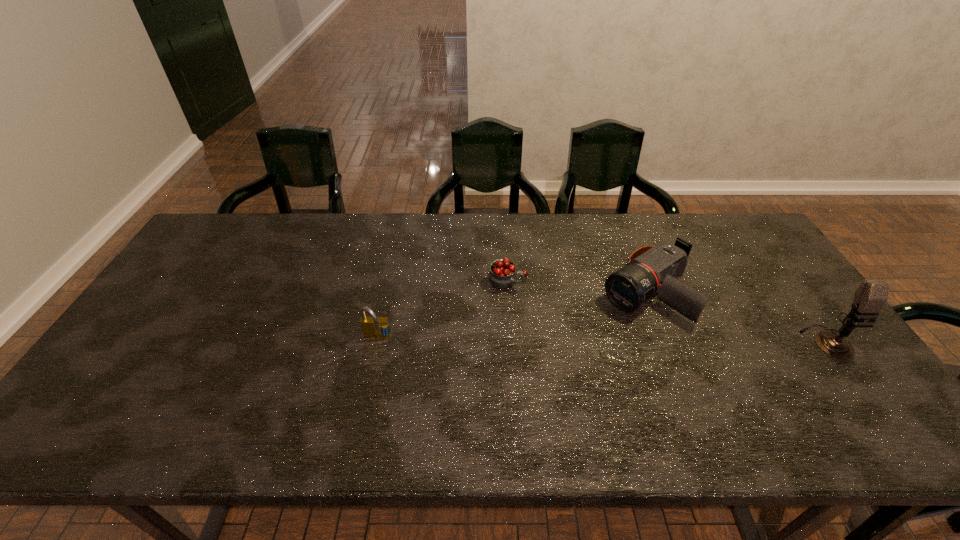
At what (x,y) coordinates should I click in order to perform the action: click on vacant space positioned on the lens of the camcorder. Please return your answer as a coordinate pair (x, y). The width and height of the screenshot is (960, 540). Looking at the image, I should click on click(x=550, y=360).

Locate an element on the screen. The width and height of the screenshot is (960, 540). free space located 0.230m on the lens of the camcorder is located at coordinates (559, 354).

Locate an element on the screen. The image size is (960, 540). free space located on the lens of the camcorder is located at coordinates (569, 347).

In order to click on object situated at the right edge in this screenshot , I will do `click(872, 294)`.

Image resolution: width=960 pixels, height=540 pixels. In the image, there is a desktop. What are the coordinates of `free space at the far edge` in the screenshot? It's located at pyautogui.click(x=327, y=217).

In the image, there is a desktop. Where is `vacant space at the near edge`? This screenshot has width=960, height=540. vacant space at the near edge is located at coordinates (174, 405).

You are a GUI agent. You are given a task and a screenshot of the screen. Output one action in this format:
    pyautogui.click(x=<x>, y=<y>)
    Task: Click on the vacant space at the left edge of the desktop
    
    Given the screenshot: What is the action you would take?
    pyautogui.click(x=201, y=296)

Locate an element on the screen. This screenshot has width=960, height=540. free region at the right edge of the desktop is located at coordinates (761, 258).

Identify the location of free region at the far right corner of the desktop. (722, 249).

Where is `free space between the padlock and the tallest object`? This screenshot has height=540, width=960. free space between the padlock and the tallest object is located at coordinates (602, 340).